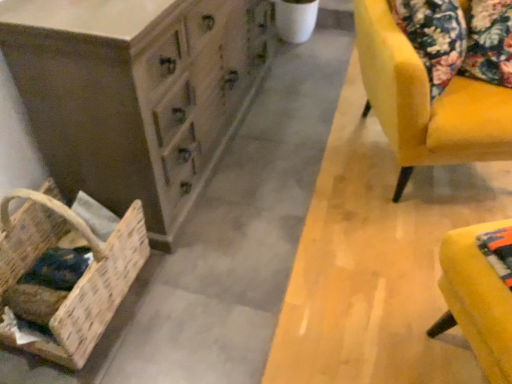
Locate an element on the screen. This screenshot has height=384, width=512. vacant position to the left of velvet yellow chair at right is located at coordinates (272, 180).